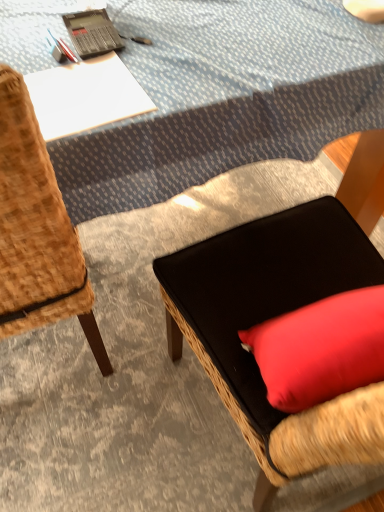
In order to click on vacant area that lies to the right of white paper at upper left in this screenshot , I will do `click(196, 76)`.